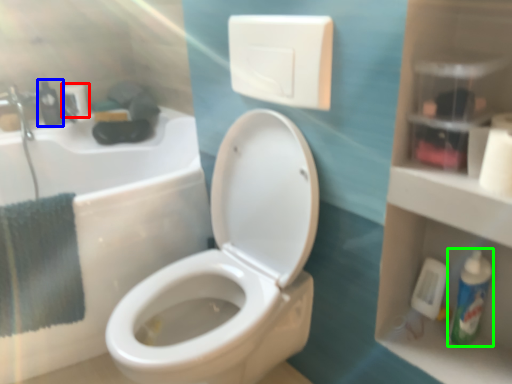
Question: Considering the real-world distances, which object is closest to toilet paper (highlighted by a red box)? mouthwash (highlighted by a blue box) or mouthwash (highlighted by a green box).

Choices:
 (A) mouthwash
 (B) mouthwash

Answer: (A)